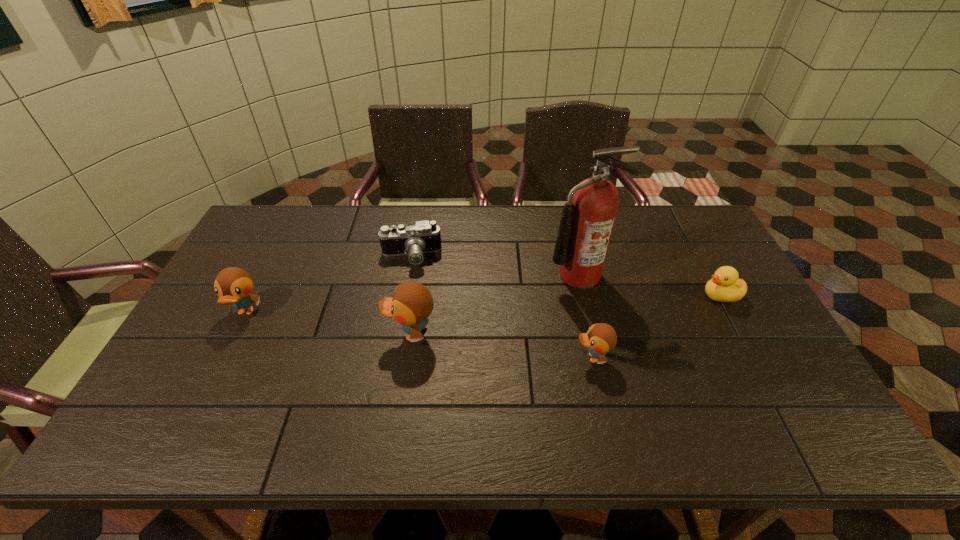
Identify the location of free space located on the front-facing side of the third duck from right to left. Image resolution: width=960 pixels, height=540 pixels. (367, 334).

Identify the location of vacant space positioned on the front-facing side of the third duck from right to left. The width and height of the screenshot is (960, 540). (330, 334).

Identify the location of vacant space located on the front-facing side of the third duck from left to right. The width and height of the screenshot is (960, 540). (436, 357).

Locate an element on the screen. free space located on the front-facing side of the third duck from left to right is located at coordinates (513, 357).

Locate an element on the screen. This screenshot has width=960, height=540. vacant area situated on the front-facing side of the third duck from left to right is located at coordinates (482, 357).

At what (x,y) coordinates should I click in order to perform the action: click on free space located on the front of the tallest object near the operation label. Please return your answer as a coordinate pair (x, y). The image size is (960, 540). Looking at the image, I should click on (592, 332).

Image resolution: width=960 pixels, height=540 pixels. Find the location of `vacant space situated at the lens of the camera`. vacant space situated at the lens of the camera is located at coordinates (395, 354).

Locate an element on the screen. vacant space located at the beak of the rightmost object is located at coordinates (627, 295).

Find the location of a particular element. The image size is (960, 540). free spot located at the beak of the rightmost object is located at coordinates (678, 295).

Locate an element on the screen. The height and width of the screenshot is (540, 960). vacant space located at the beak of the rightmost object is located at coordinates (678, 295).